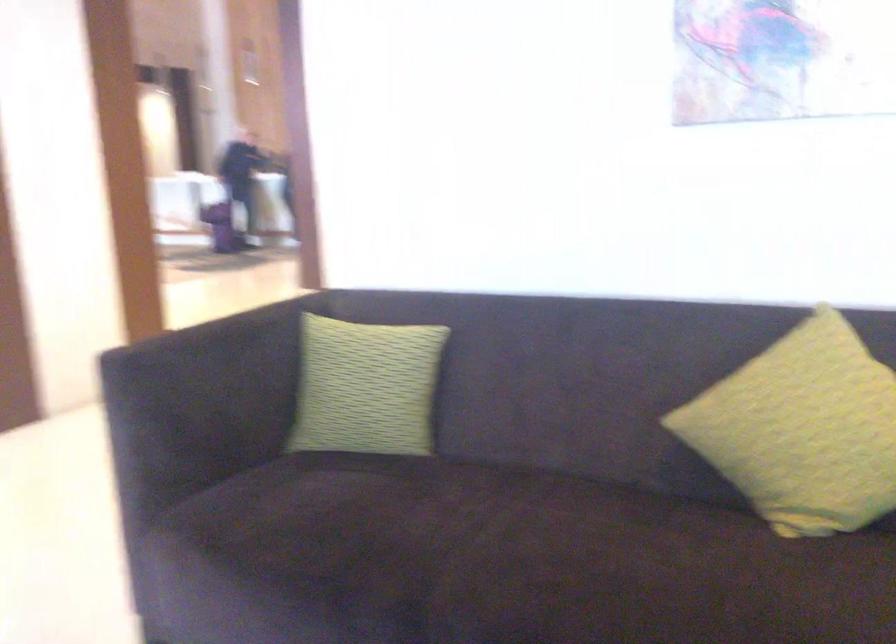
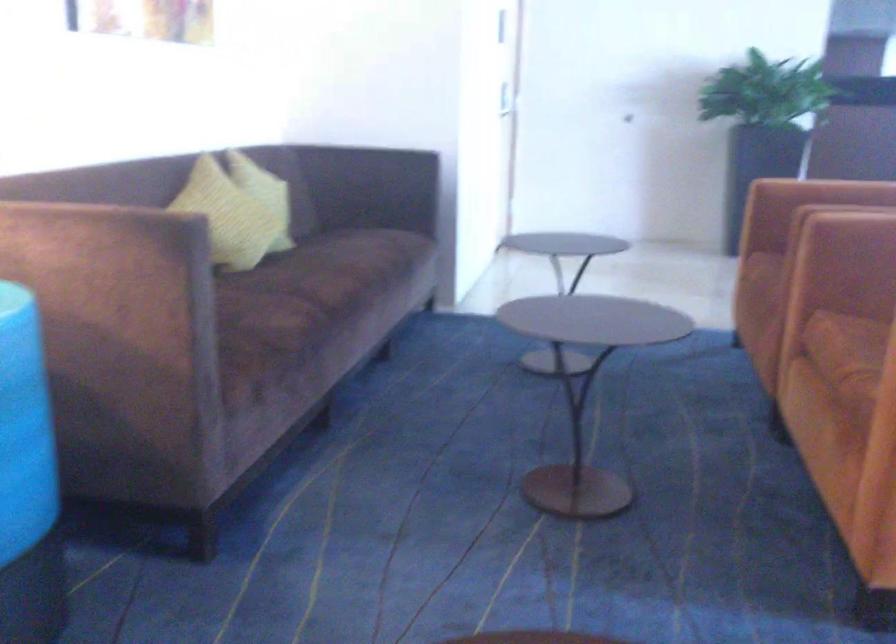
Question: The first image is from the beginning of the video and the second image is from the end. How did the camera likely rotate when shooting the video?

Choices:
 (A) Left
 (B) Right
 (C) Up
 (D) Down

Answer: (B)